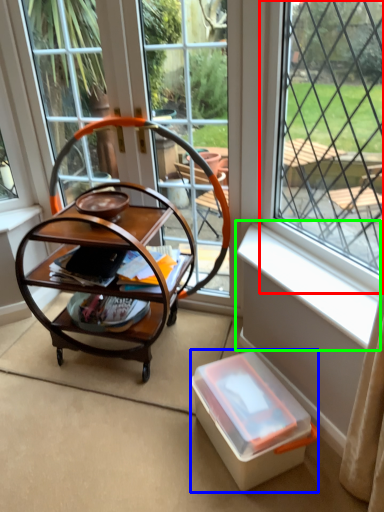
Question: Which object is the closest to the window (highlighted by a red box)? Choose among these: box (highlighted by a blue box) or window sill (highlighted by a green box).

Choices:
 (A) box
 (B) window sill

Answer: (B)